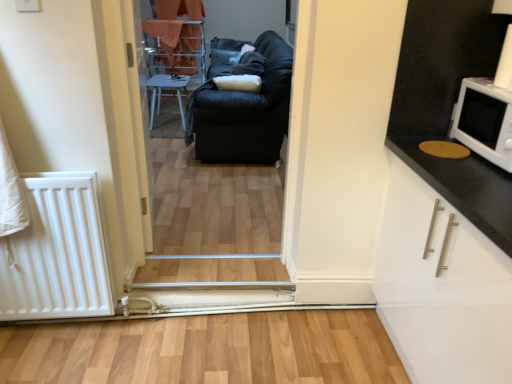
This screenshot has width=512, height=384. Find the location of `blank space above white glossy cabinet at right (from a real-world perspective)`. blank space above white glossy cabinet at right (from a real-world perspective) is located at coordinates (466, 164).